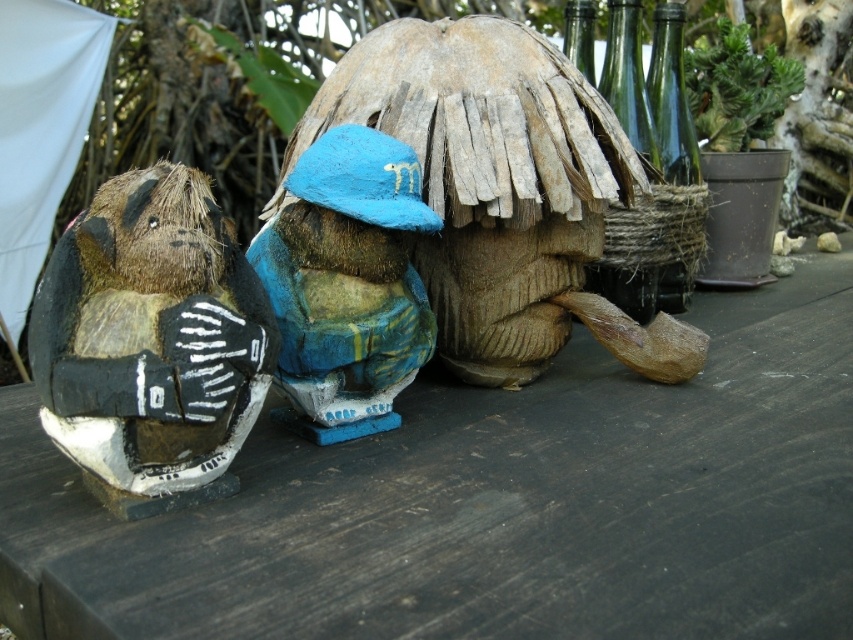
Between green succulent at upper right and green leafy plant at upper center, which one appears on the left side from the viewer's perspective?

green leafy plant at upper center is more to the left.

Does point (735, 129) lie in front of point (308, 81)?

Yes.

Is point (747, 44) positioned behind point (260, 104)?

No, it is in front of (260, 104).

Where is `green succulent at upper right`? Image resolution: width=853 pixels, height=640 pixels. green succulent at upper right is located at coordinates (737, 88).

Which is in front, point (544, 358) or point (227, 54)?

Point (544, 358)

Who is higher up, wooden figure at center or green leafy plant at upper center?

Positioned higher is green leafy plant at upper center.

Does point (587, 102) come farther from viewer compared to point (242, 67)?

No, it is in front of (242, 67).

At what (x,y) coordinates should I click in order to perform the action: click on wooden figure at center. Please return your answer as a coordinate pair (x, y). The image size is (853, 640). Looking at the image, I should click on (503, 192).

Which is below, fuzzy brown plush at left or green succulent at upper right?

Positioned lower is fuzzy brown plush at left.

Is point (230, 369) positioned in front of point (752, 132)?

Yes, it is.

Between point (146, 276) and point (769, 102), which one is positioned in front?

Positioned in front is point (146, 276).

Identify the location of fuzzy brown plush at left. [x=151, y=342].